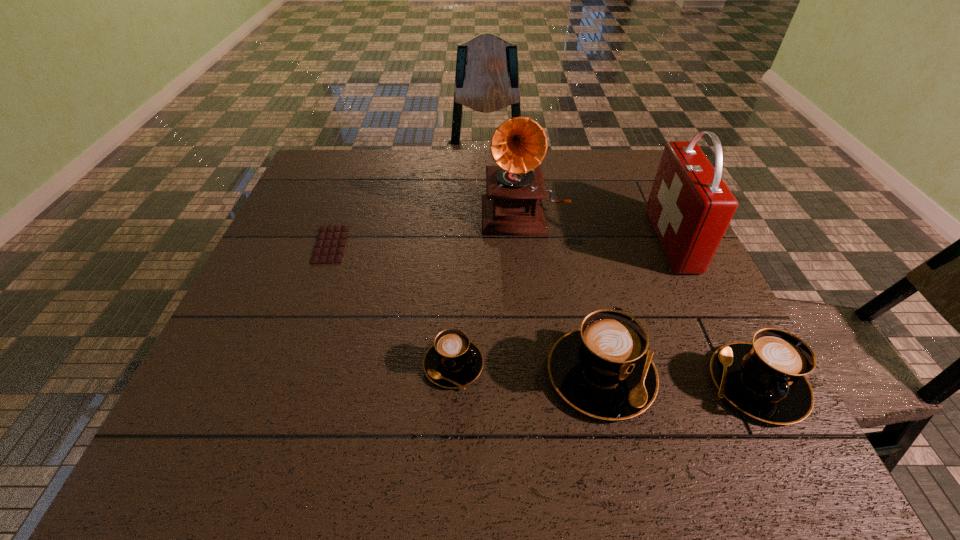
Please show where to add a cappuccino on the left while keeping spacing even. Please provide its 2D coordinates. Your answer should be formatted as a tuple, i.e. [(x, y)], where the tuple contains the x and y coordinates of a point satisfying the conditions above.

[(310, 356)]